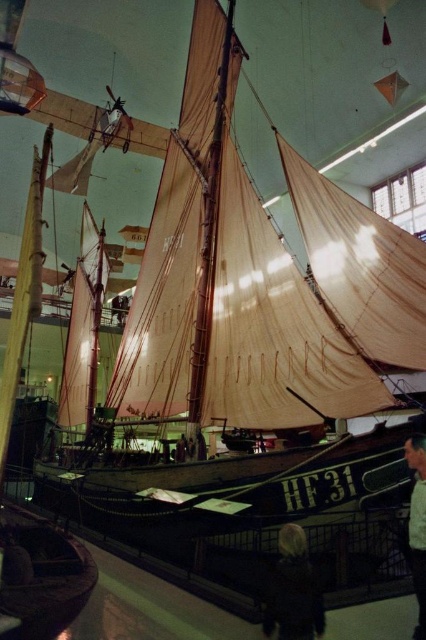
Question: Does dark hair at lower center have a lesser width compared to light brown leather jacket at lower right?

Choices:
 (A) yes
 (B) no

Answer: (B)

Question: Is the position of dark hair at lower center more distant than that of light brown leather jacket at lower right?

Choices:
 (A) yes
 (B) no

Answer: (B)

Question: Which point appears farthest from the camera in this image?

Choices:
 (A) (423, 456)
 (B) (296, 577)

Answer: (B)

Question: Which point is closer to the camera?

Choices:
 (A) dark hair at lower center
 (B) light brown leather jacket at lower right

Answer: (A)

Question: Is dark hair at lower center wider than light brown leather jacket at lower right?

Choices:
 (A) yes
 (B) no

Answer: (A)